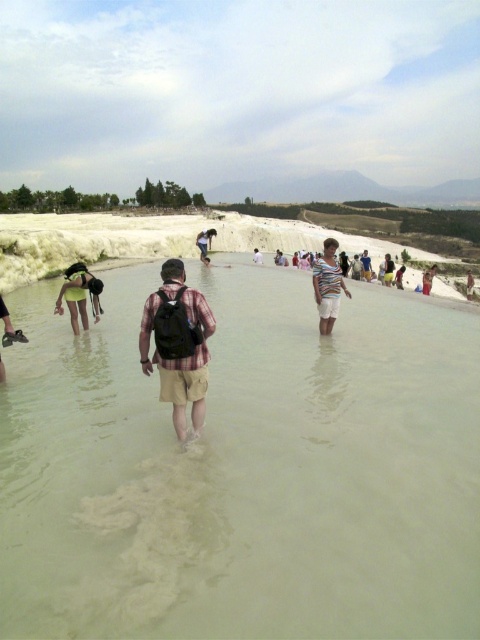
Question: Is the position of matte green swimsuit at left more distant than that of matte black backpack at center?

Choices:
 (A) no
 (B) yes

Answer: (A)

Question: Which object appears closest to the camera in this image?

Choices:
 (A) light blue denim shorts at center
 (B) light blue fabric shirt at center

Answer: (B)

Question: Does plaid fabric shirt at center have a lesser width compared to striped cotton shirt at center?

Choices:
 (A) yes
 (B) no

Answer: (A)

Question: Is matte black backpack at center thinner than light brown sand at center?

Choices:
 (A) yes
 (B) no

Answer: (B)

Question: Which point is farther from the camera taking this photo?

Choices:
 (A) (384, 264)
 (B) (432, 276)
 (C) (472, 276)

Answer: (C)

Question: Which of the following is the farthest from the observer?

Choices:
 (A) greenish murky water at center
 (B) light blue fabric shirt at center
 (C) light brown sand at center

Answer: (C)